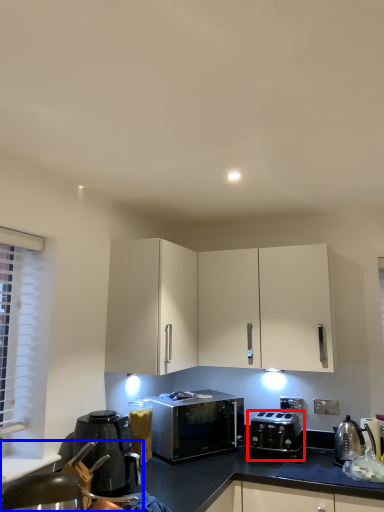
Question: Which point is closer to the camera, toaster (highlighted by a red box) or swivel chair (highlighted by a blue box)?

Choices:
 (A) toaster
 (B) swivel chair

Answer: (B)